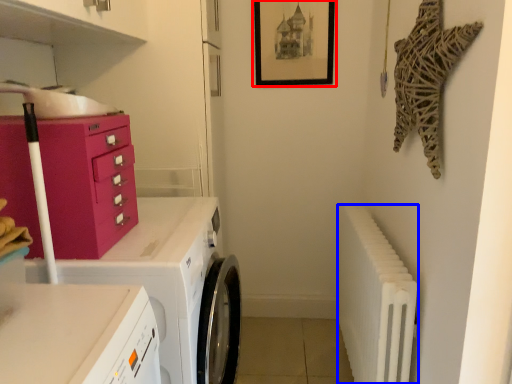
Question: Which object appears farthest to the camera in this image, picture frame (highlighted by a red box) or radiator (highlighted by a blue box)?

Choices:
 (A) picture frame
 (B) radiator

Answer: (A)